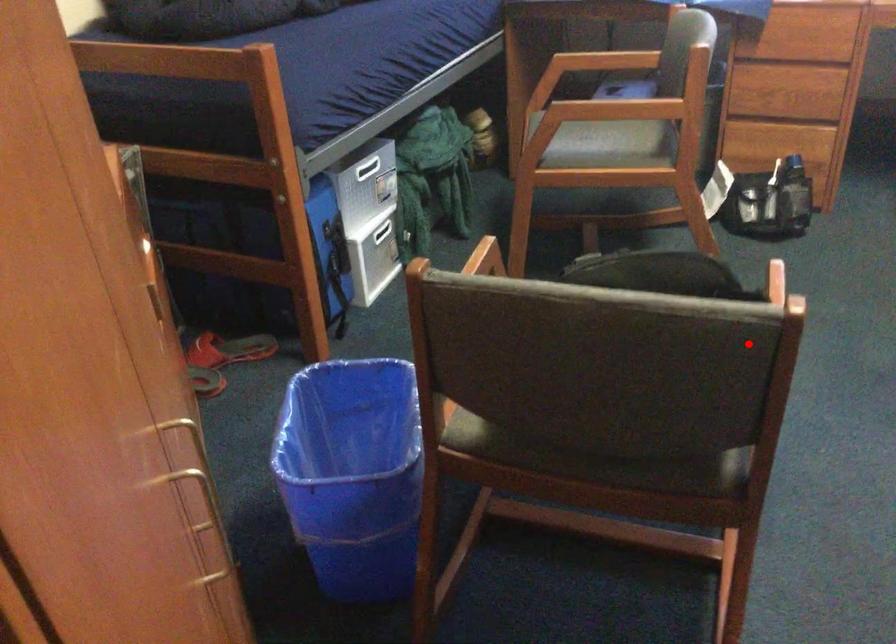
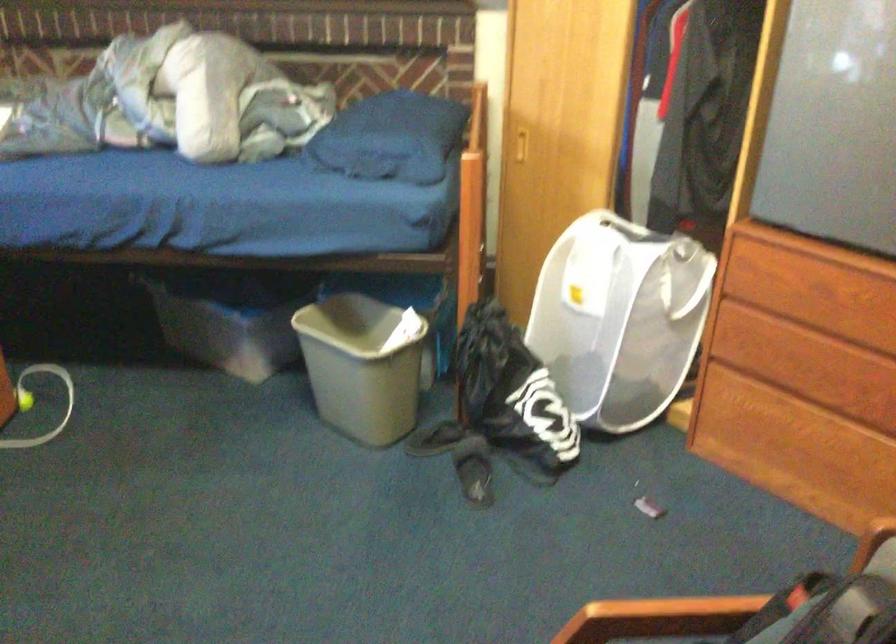
The point at the highlighted location is marked in the first image. Where is the corresponding point in the second image?

(757, 614)